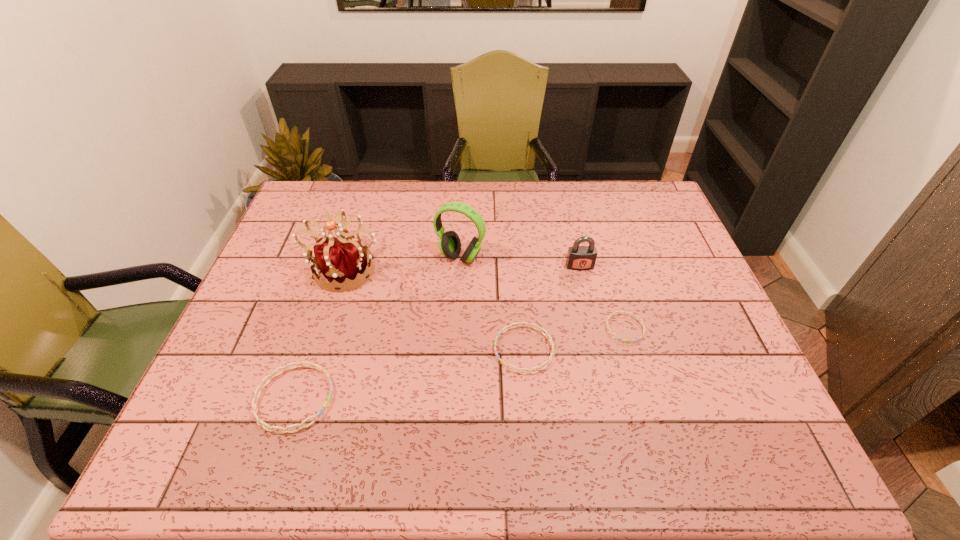
You are a GUI agent. You are given a task and a screenshot of the screen. Output one action in this format:
    pyautogui.click(x=<x>, y=<y>)
    Task: Click on the free space located on the surface of the fourth object from left to right showing star-shaped elements
    
    Given the screenshot: What is the action you would take?
    pyautogui.click(x=414, y=349)

This screenshot has height=540, width=960. I want to click on blank space located 0.300m on the surface of the fourth object from left to right showing star-shaped elements, so click(373, 349).

Locate an element on the screen. The height and width of the screenshot is (540, 960). vacant space located on the surface of the shortest object showing star-shaped elements is located at coordinates (641, 386).

I want to click on free point located 0.400m on the front of the third tallest object near the keyhole, so click(609, 393).

Identify the location of free spot located 0.200m on the front-facing side of the tiara. The image size is (960, 540). (318, 355).

Where is `free space located on the right of the headset`? free space located on the right of the headset is located at coordinates (562, 257).

This screenshot has width=960, height=540. Find the location of `object at the near edge`. object at the near edge is located at coordinates (254, 401).

Locate an element on the screen. bracelet that is at the left edge is located at coordinates (254, 401).

The height and width of the screenshot is (540, 960). Find the location of `tiara located at the left edge`. tiara located at the left edge is located at coordinates (340, 260).

The width and height of the screenshot is (960, 540). I want to click on object that is at the near left corner, so click(254, 401).